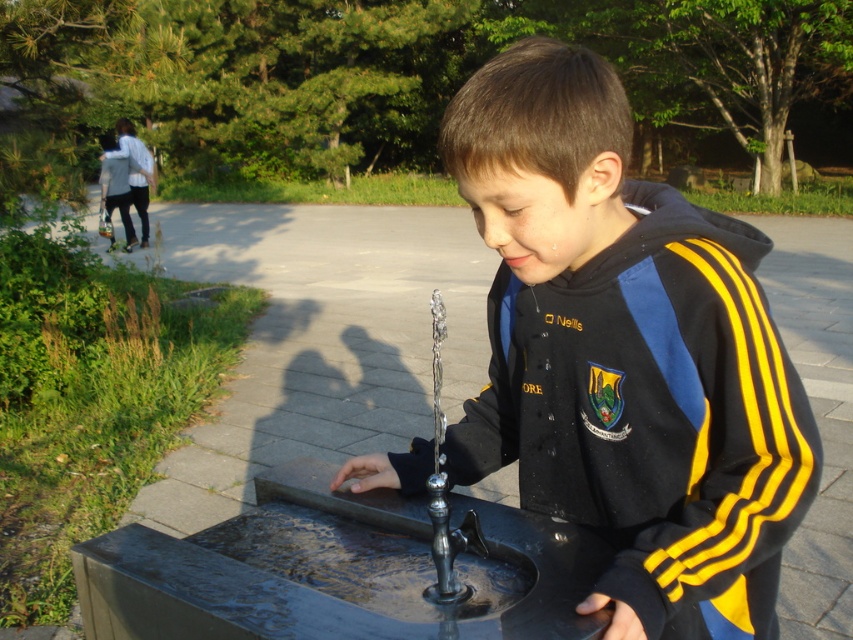
Question: Can you confirm if black/yellow track jacket at center is wider than transparent glass hand at center?

Choices:
 (A) no
 (B) yes

Answer: (B)

Question: Estimate the real-world distances between objects in this image. Which object is farther from the black/yellow track jacket at center?

Choices:
 (A) transparent glass hand at center
 (B) polished metal fountain at center

Answer: (A)

Question: Which of the following is the farthest from the observer?

Choices:
 (A) (631, 506)
 (B) (374, 486)

Answer: (B)

Question: Among these objects, which one is farthest from the camera?

Choices:
 (A) black/yellow track jacket at center
 (B) transparent glass hand at center

Answer: (B)

Question: Is black/yellow track jacket at center positioned before transparent glass hand at center?

Choices:
 (A) yes
 (B) no

Answer: (A)

Question: From the image, what is the correct spatial relationship of black/yellow track jacket at center in relation to polished metal fountain at center?

Choices:
 (A) right
 (B) left

Answer: (A)